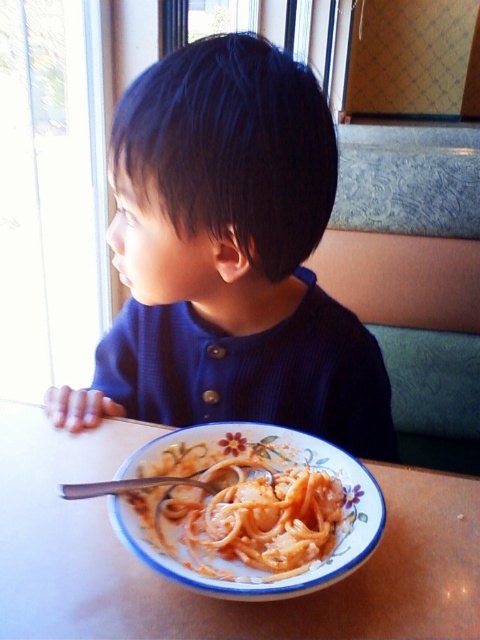
You are a photographer trying to capture the scene from the child perspective. Since the dark blue sweater at upper left and the white glossy table at lower center are in the frame, which object would appear closer to the camera based on their height in the image?

The dark blue sweater at upper left appears closer to the camera because it is taller than the white glossy table at lower center in the image.

From the picture: You are standing in a restaurant and see a point marked at coordinates (x=262, y=403). If you want to place a 24 inch wide plate on the table, will it fit entirely within the visible area of the table?

The point at (x=262, y=403) is 27.57 inches from the viewer, so the plate will fit as it is smaller than the distance from the viewer to the point.